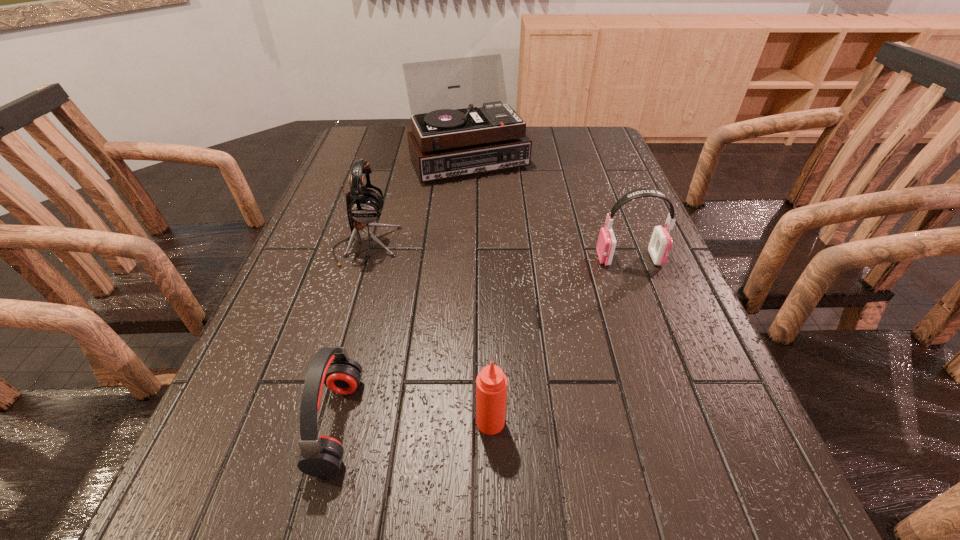
Where is `vacant region located 0.390m on the right of the Tabasco sauce`? This screenshot has width=960, height=540. vacant region located 0.390m on the right of the Tabasco sauce is located at coordinates (744, 422).

The height and width of the screenshot is (540, 960). I want to click on blank space located on the ear cups of the nearest earphone, so click(467, 424).

Where is `object present at the far edge`? Image resolution: width=960 pixels, height=540 pixels. object present at the far edge is located at coordinates [x=452, y=135].

At what (x,y) coordinates should I click in order to perform the action: click on object situated at the left edge. Please return your answer as a coordinate pair (x, y). The height and width of the screenshot is (540, 960). Looking at the image, I should click on (364, 205).

I want to click on object at the right edge, so click(660, 244).

In the image, there is a desktop. Where is `free space at the far edge`? free space at the far edge is located at coordinates (538, 134).

What are the coordinates of `vacant space at the left edge` in the screenshot? It's located at (238, 428).

This screenshot has width=960, height=540. What are the coordinates of `vacant space at the far right corner` in the screenshot? It's located at (611, 143).

The width and height of the screenshot is (960, 540). What are the coordinates of `free spot between the rightmost earphone and the record player` in the screenshot? It's located at (549, 208).

This screenshot has width=960, height=540. I want to click on free space between the farthest object and the shortest earphone, so click(403, 291).